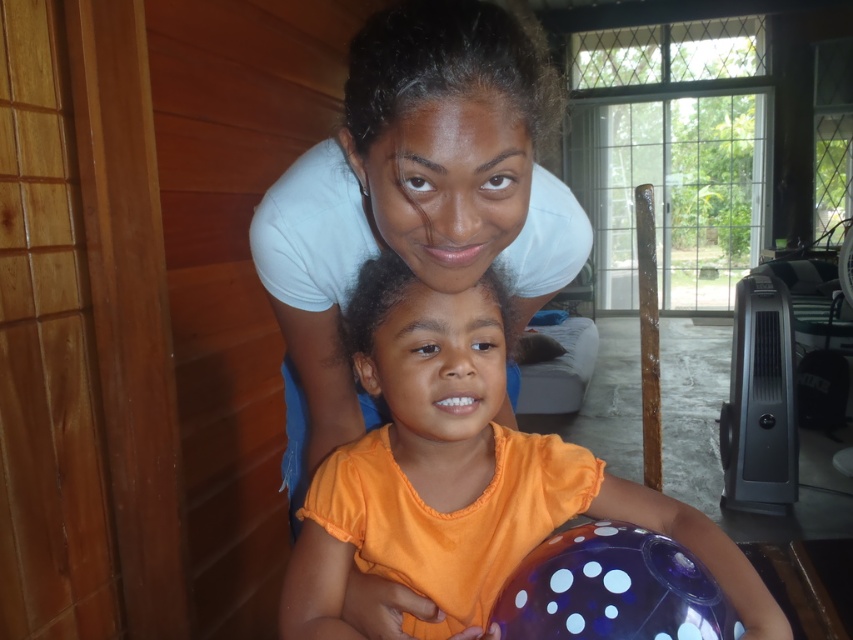
Which is more to the left, white smooth t-shirt at upper center or orange matte shirt at center?

white smooth t-shirt at upper center is more to the left.

From the picture: Is white smooth t-shirt at upper center further to camera compared to orange matte shirt at center?

No.

Who is more forward, (296, 228) or (349, 340)?

Point (349, 340) is in front.

The image size is (853, 640). Find the location of `white smooth t-shirt at upper center`. white smooth t-shirt at upper center is located at coordinates (413, 198).

Is point (368, 96) farther from camera compared to point (671, 625)?

No.

Which is behind, point (395, 189) or point (563, 620)?

Point (395, 189)

This screenshot has width=853, height=640. I want to click on white smooth t-shirt at upper center, so click(413, 198).

Does orange matte shirt at center appear on the left side of translucent purple beach ball at lower center?

Indeed, orange matte shirt at center is positioned on the left side of translucent purple beach ball at lower center.

Between point (392, 358) and point (596, 554), which one is positioned in front?

Point (596, 554)

Identify the location of orange matte shirt at center. (461, 474).